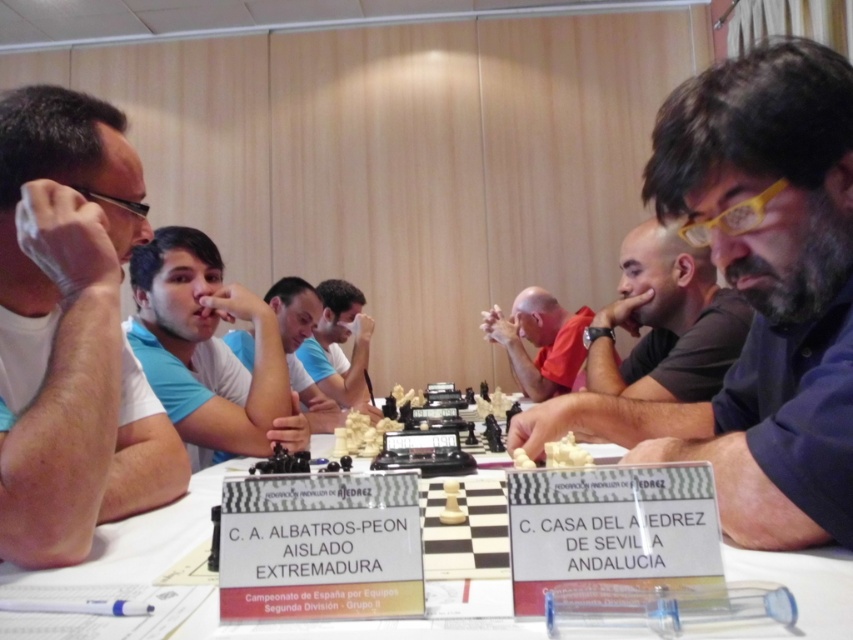
You are a photographer standing at the center of the room. You want to take a photo of the white matte shirt at left. Where should you point your camera?

You should point your camera towards the left side of the scene at point coordinates approximately 0.517 on the x axis and 0.088 on the y axis to capture the white matte shirt at left.

You are a photographer taking a photo of the chess tournament scene. You want to ensure both the matte black chess piece at center and the light blue fabric shirt at center are clearly visible in the shot. Given their height difference, which object might require you to adjust your camera angle to avoid being blocked by the other?

The light blue fabric shirt at center is shorter than the matte black chess piece at center. To prevent the taller matte black chess piece at center from blocking the shorter light blue fabric shirt at center, you should adjust your camera angle to look slightly downward.

You are a photographer setting up for a chess tournament photo shoot. You need to ensure that both the white matte shirt at left and the blue matte shirt at center are clearly visible in the shot. Given their positions, which shirt should you focus on first to ensure both are in focus?

The white matte shirt at left is in front of the blue matte shirt at center, so you should focus on the white matte shirt at left first to ensure both are in focus.